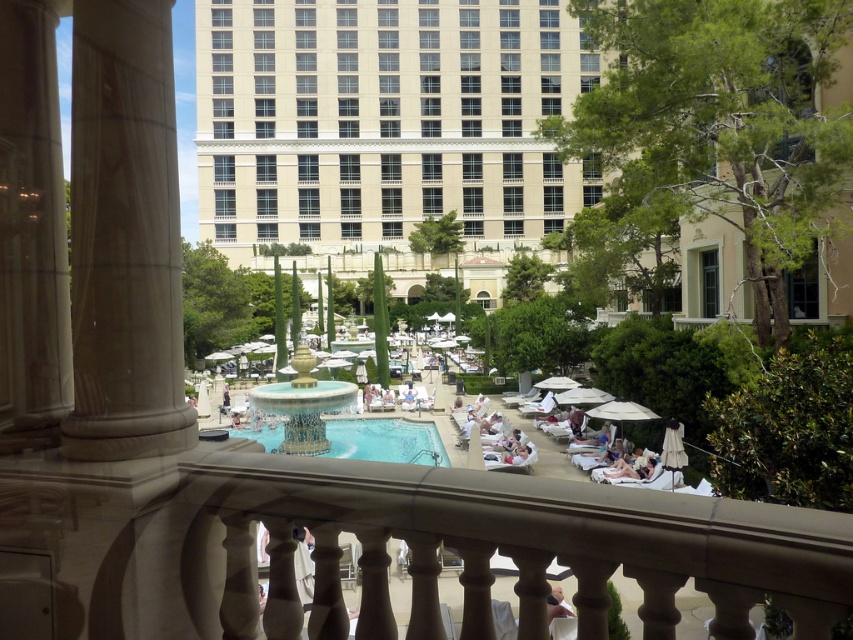
What do you see at coordinates (386, 440) in the screenshot? This screenshot has width=853, height=640. I see `clear glass pool at center` at bounding box center [386, 440].

Is point (363, 429) closer to viewer compared to point (555, 596)?

No, it is behind (555, 596).

Find the location of a particular element. Image resolution: width=853 pixels, height=640 pixels. clear glass pool at center is located at coordinates (386, 440).

Does smooth stone railing at center have a greater width compared to smooth beige towel at lower center?

Indeed, smooth stone railing at center has a greater width compared to smooth beige towel at lower center.

Who is positioned more to the right, smooth stone railing at center or smooth beige towel at lower center?

From the viewer's perspective, smooth beige towel at lower center appears more on the right side.

Measure the distance between smooth stone railing at center and camera.

8.76 meters

The image size is (853, 640). I want to click on smooth stone railing at center, so click(494, 548).

Is beige/smooth/facade at upper center positioned behind smooth stone railing at center?

That is True.

Is beige/smooth/facade at upper center above smooth stone railing at center?

Yes.

Between point (196, 68) and point (762, 552), which one is positioned in front?

Point (762, 552) is more forward.

At what (x,y) coordinates should I click in order to perform the action: click on beige/smooth/facade at upper center. Please return your answer as a coordinate pair (x, y). Looking at the image, I should click on point(384,120).